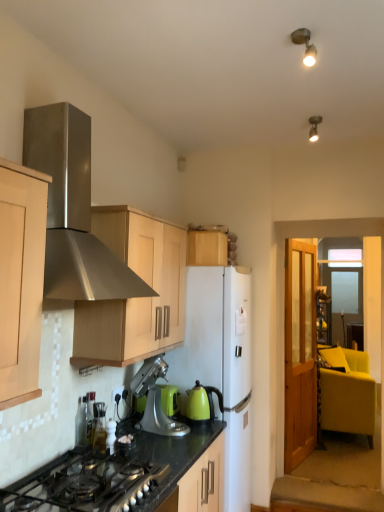
This screenshot has width=384, height=512. Find the location of `free spot to the right of brushed metal toaster at lower left, the second appliance in the front-to-back sequence`. free spot to the right of brushed metal toaster at lower left, the second appliance in the front-to-back sequence is located at coordinates (113, 450).